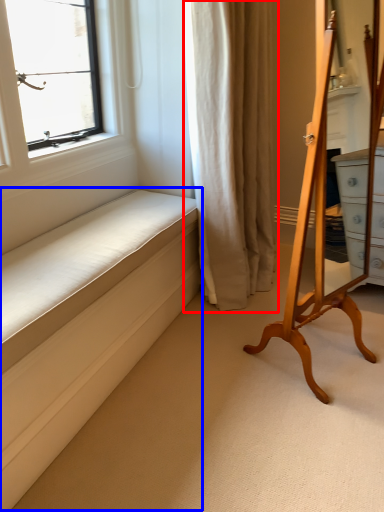
Question: Which object is further to the camera taking this photo, curtain (highlighted by a red box) or bed frame (highlighted by a blue box)?

Choices:
 (A) curtain
 (B) bed frame

Answer: (A)